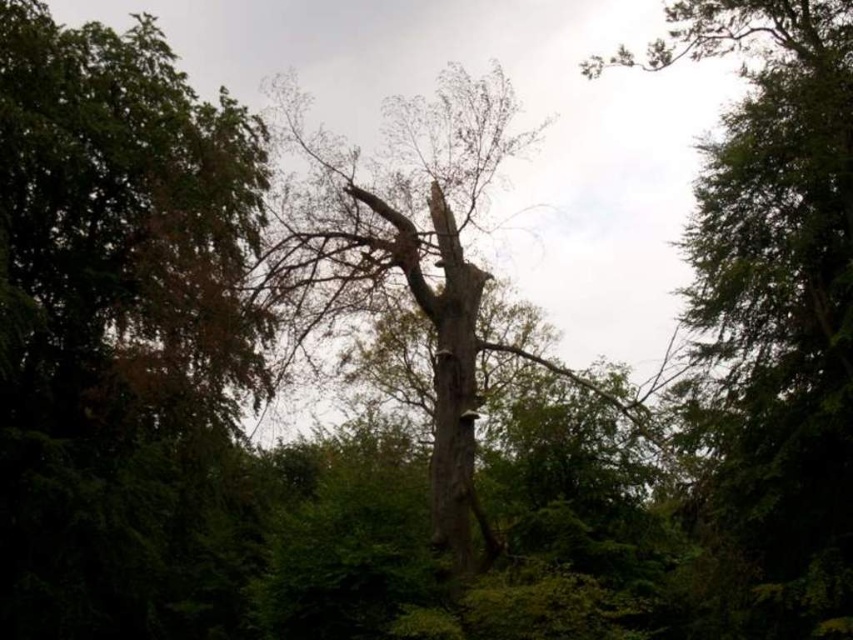
You are standing in the forest scene looking at the large weathered tree. There are two points marked in the image. Which point is closer to you, point (x=44, y=8) or point (x=451, y=428)?

Point (x=44, y=8) is further to the camera than point (x=451, y=428), so point (x=451, y=428) is closer to you.